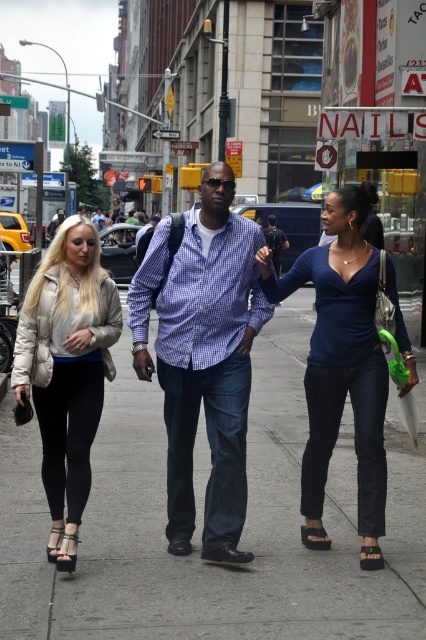
Is purple checkered shirt at center wider than matte blue top at center?

Incorrect, purple checkered shirt at center's width does not surpass matte blue top at center's.

In order to click on purple checkered shirt at center in this screenshot , I will do `click(203, 356)`.

Does gray concrete sidewalk at center appear on the right side of beige puffer jacket at left?

Yes, gray concrete sidewalk at center is to the right of beige puffer jacket at left.

Is point (273, 497) behind point (88, 330)?

Yes, it is behind point (88, 330).

Looking at this image, who is more distant from viewer, (x=325, y=525) or (x=55, y=244)?

Point (x=325, y=525)

You are a GUI agent. You are given a task and a screenshot of the screen. Output one action in this format:
    pyautogui.click(x=<x>, y=<y>)
    Task: Click on the gray concrete sidewalk at center
    
    Given the screenshot: What is the action you would take?
    pyautogui.click(x=201, y=524)

Is matte blue top at center wider than beige puffer jacket at left?

Correct, the width of matte blue top at center exceeds that of beige puffer jacket at left.

Who is shorter, matte blue top at center or beige puffer jacket at left?

Standing shorter between the two is beige puffer jacket at left.

The image size is (426, 640). In order to click on matte blue top at center in this screenshot , I will do `click(342, 364)`.